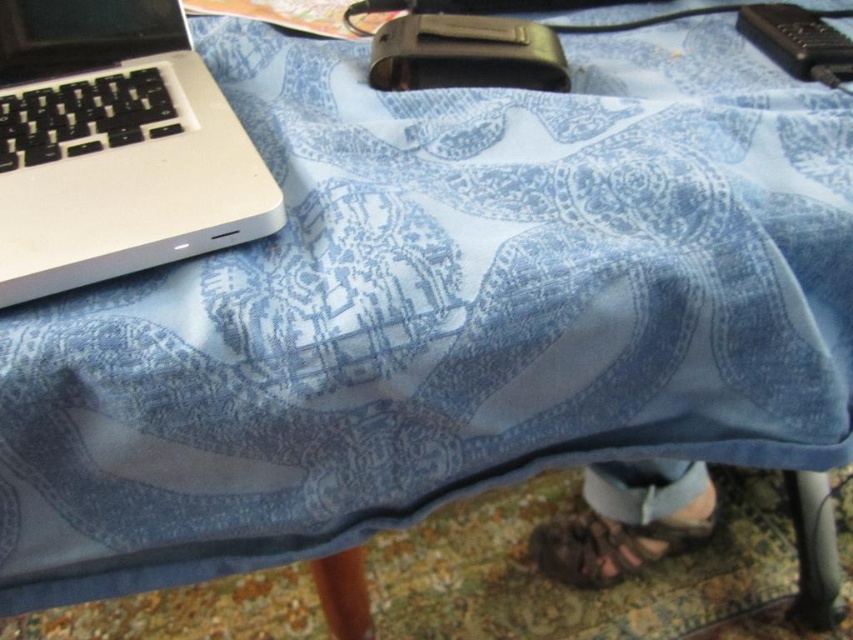
Which of these two, white matte laptop at left or denim pants at lower right, stands taller?

Standing taller between the two is white matte laptop at left.

Is white matte laptop at left to the left of denim pants at lower right from the viewer's perspective?

Yes, white matte laptop at left is to the left of denim pants at lower right.

The image size is (853, 640). I want to click on white matte laptop at left, so click(115, 147).